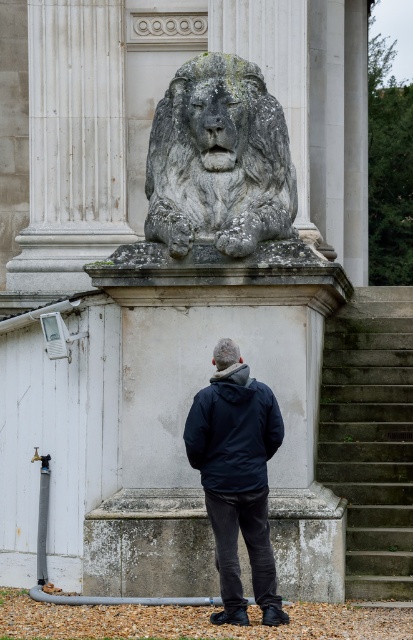
Question: Can you confirm if gray stone lion at center is thinner than navy blue jacket at center?

Choices:
 (A) yes
 (B) no

Answer: (B)

Question: Which of these objects is positioned farthest from the navy blue jacket at center?

Choices:
 (A) dark blue jacket at center
 (B) gray stone lion at center

Answer: (B)

Question: Is gray concrete stairs at lower right to the right of dark blue jacket at center from the viewer's perspective?

Choices:
 (A) yes
 (B) no

Answer: (A)

Question: Is dark blue jacket at center positioned behind navy blue jacket at center?

Choices:
 (A) no
 (B) yes

Answer: (B)

Question: Which point is closer to the camera?

Choices:
 (A) dark blue jacket at center
 (B) navy blue jacket at center
 (C) gray concrete stairs at lower right
 (D) gray stone lion at center

Answer: (B)

Question: Which object is farther from the camera taking this photo?

Choices:
 (A) gray concrete stairs at lower right
 (B) dark blue jacket at center
 (C) navy blue jacket at center
 (D) gray stone lion at center

Answer: (A)